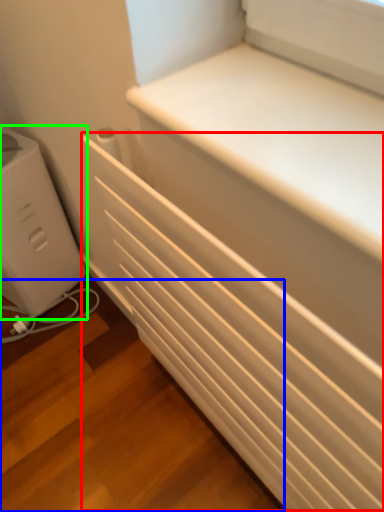
Question: Which object is the closest to the radiator (highlighted by a red box)? Choose among these: stairwell (highlighted by a blue box) or home appliance (highlighted by a green box).

Choices:
 (A) stairwell
 (B) home appliance

Answer: (A)